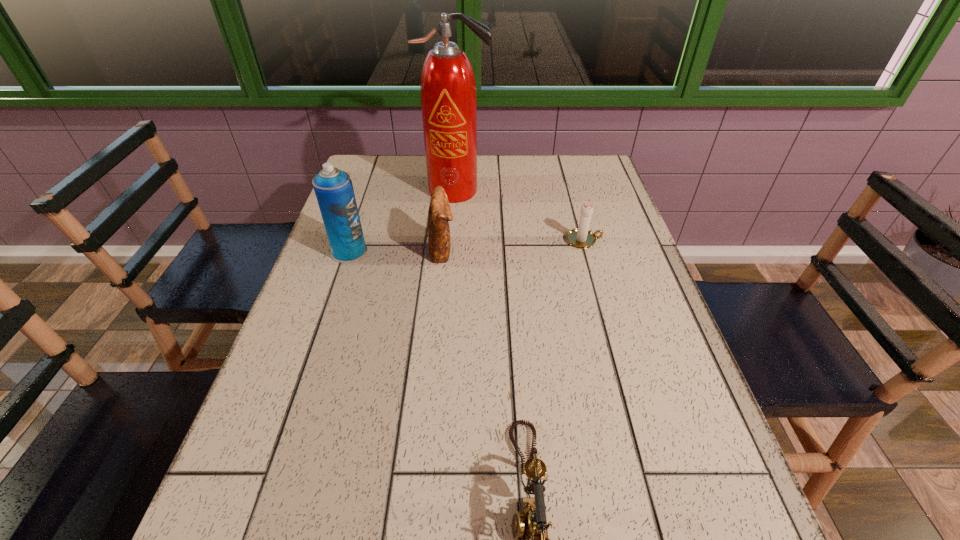
At what (x,y) coordinates should I click in order to perform the action: click on object that is at the far edge. Please return your answer as a coordinate pair (x, y). Looking at the image, I should click on (448, 90).

At what (x,y) coordinates should I click in order to perform the action: click on object present at the left edge. Please return your answer as a coordinate pair (x, y). This screenshot has height=540, width=960. Looking at the image, I should click on (334, 191).

Locate an element on the screen. object that is at the right edge is located at coordinates (581, 237).

In the image, there is a desktop. Where is `vacant space at the far edge`? Image resolution: width=960 pixels, height=540 pixels. vacant space at the far edge is located at coordinates click(521, 170).

Image resolution: width=960 pixels, height=540 pixels. I want to click on free space at the left edge of the desktop, so [208, 531].

The width and height of the screenshot is (960, 540). I want to click on vacant space at the right edge of the desktop, so pos(666,478).

This screenshot has height=540, width=960. In order to click on vacant space at the far right corner of the desktop in this screenshot , I will do `click(578, 187)`.

Locate an element on the screen. The height and width of the screenshot is (540, 960). vacant space that's between the farthest object and the aerosol can is located at coordinates (403, 221).

You are a GUI agent. You are given a task and a screenshot of the screen. Output one action in this format:
    pyautogui.click(x=<x>, y=<y>)
    Task: Click on the vacant point located between the fourth shortest object and the third tallest object
    
    Given the screenshot: What is the action you would take?
    pyautogui.click(x=396, y=251)

This screenshot has height=540, width=960. In order to click on free space between the fire extinguisher and the candle holder in this screenshot , I will do `click(520, 215)`.